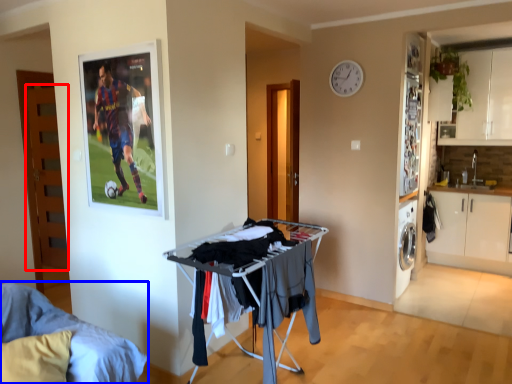
Question: Which object appears farthest to the camera in this image, door (highlighted by a red box) or furniture (highlighted by a blue box)?

Choices:
 (A) door
 (B) furniture

Answer: (A)